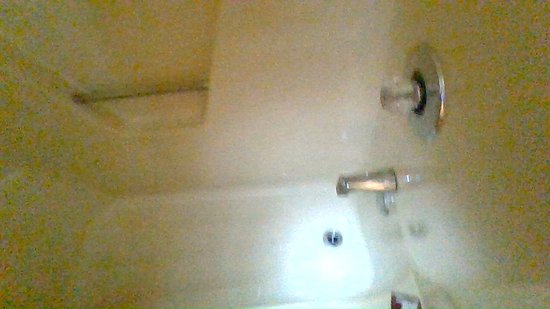
Where is `water faucet`? water faucet is located at coordinates (368, 183).